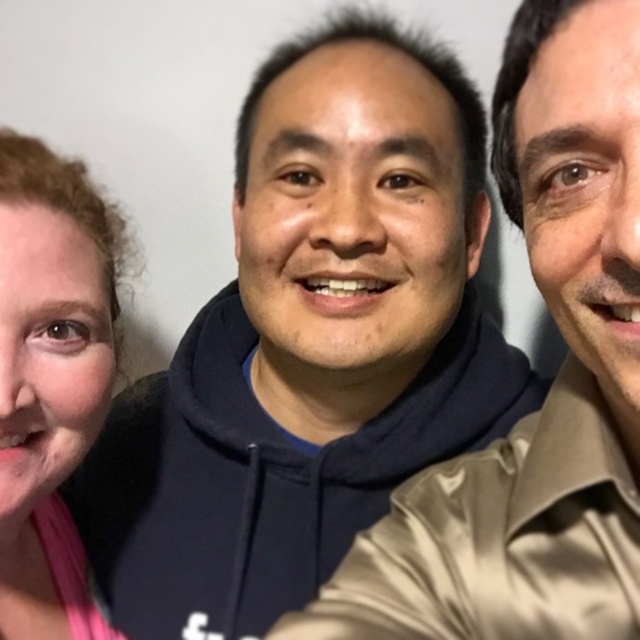
Question: Which point is closer to the camera taking this photo?

Choices:
 (A) (115, 301)
 (B) (497, 504)

Answer: (B)

Question: Is dark blue hoodie at center to the right of pink fabric at left from the viewer's perspective?

Choices:
 (A) yes
 (B) no

Answer: (A)

Question: Among these objects, which one is nearest to the camera?

Choices:
 (A) dark blue hoodie at center
 (B) pink fabric at left

Answer: (A)

Question: Which point is farther to the camera?

Choices:
 (A) (32, 566)
 (B) (573, 618)

Answer: (A)

Question: Is dark blue hoodie at center smaller than pink fabric at left?

Choices:
 (A) no
 (B) yes

Answer: (A)

Question: Can you confirm if dark blue hoodie at center is thinner than pink fabric at left?

Choices:
 (A) yes
 (B) no

Answer: (B)